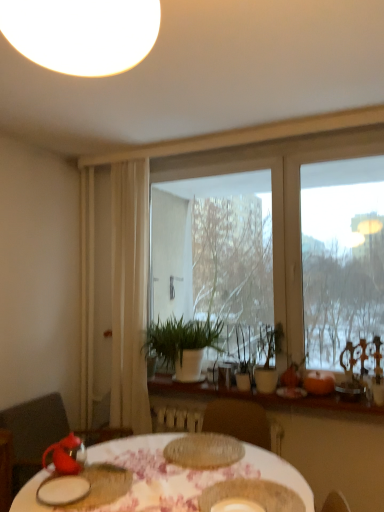
I want to click on free spot in front of translucent glass plate at center, the 7th tableware in the right-to-left sequence, so 186,481.